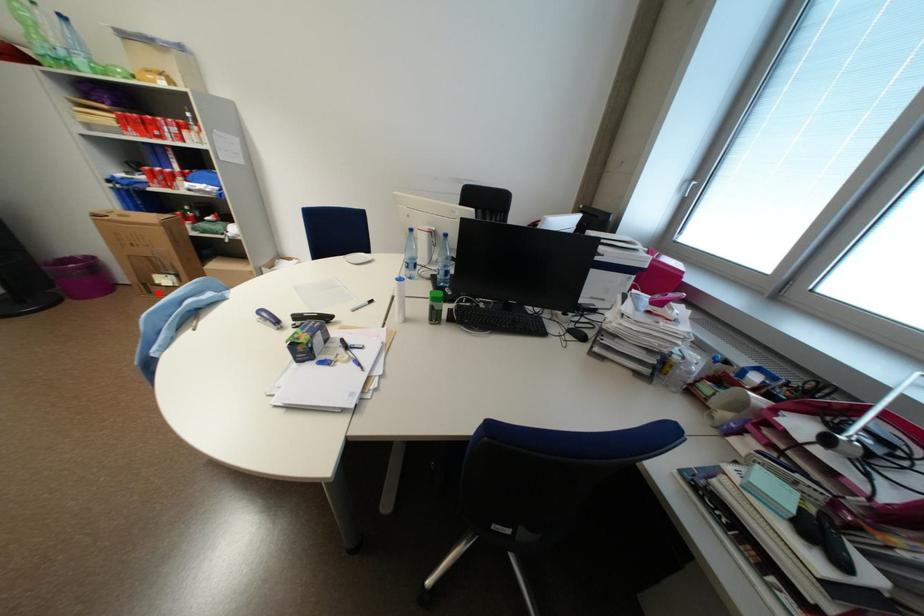
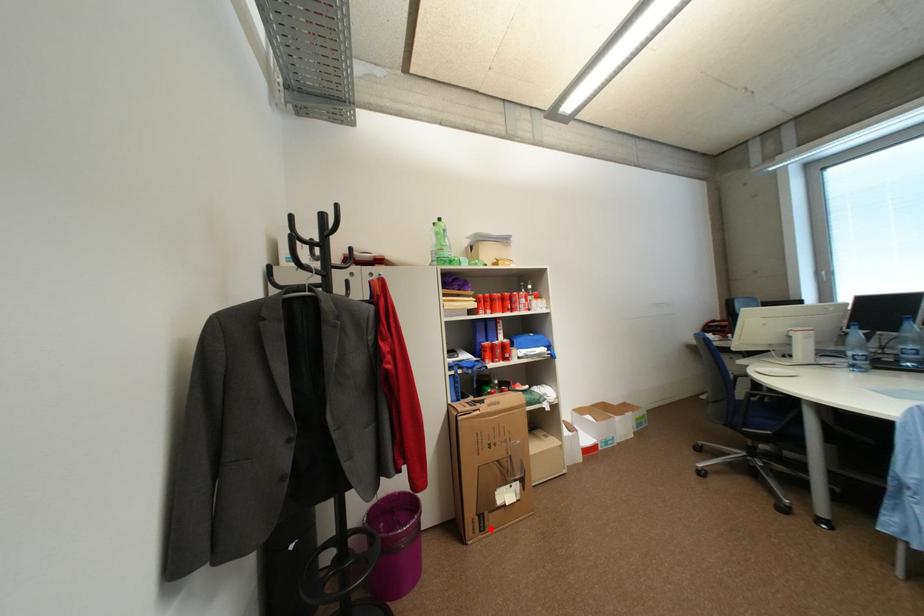
I am providing you with two images of the same scene from different viewpoints. A red point is marked on the first image and another point is marked on the second image. Are the points marked in image1 and image2 representing the same 3D position?

Yes